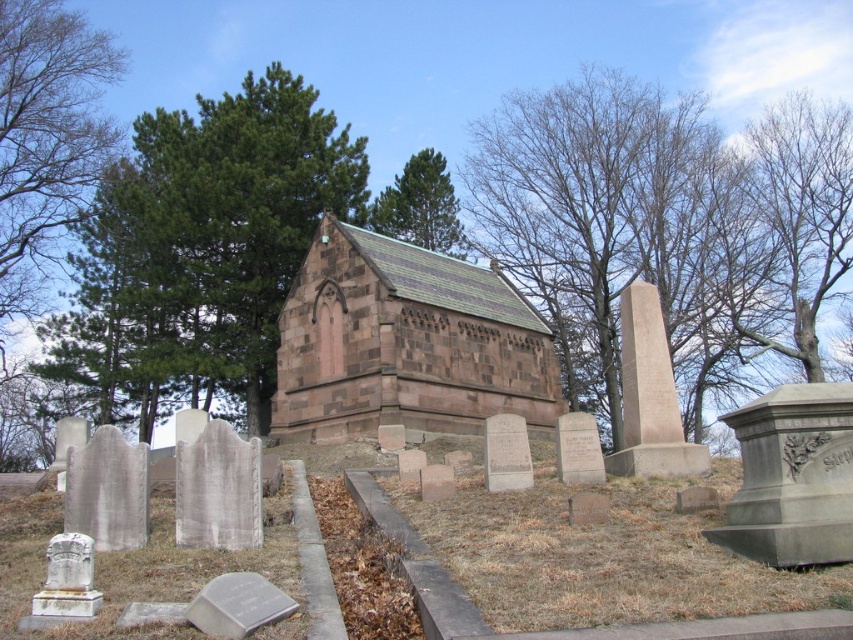
Which is behind, point (366, 260) or point (448, 211)?

Positioned behind is point (448, 211).

Image resolution: width=853 pixels, height=640 pixels. What do you see at coordinates (405, 342) in the screenshot?
I see `brown stone church at center` at bounding box center [405, 342].

I want to click on brown stone church at center, so click(x=405, y=342).

Can you confirm if bare wood tree at upper center is positioned below green leafy tree at upper center?

Yes.

Who is shorter, bare wood tree at upper center or green leafy tree at upper center?

green leafy tree at upper center

Who is more forward, (630,157) or (392,228)?

Point (392,228) is more forward.

Where is `bare wood tree at upper center`? This screenshot has height=640, width=853. bare wood tree at upper center is located at coordinates (608, 225).

Is green leafy tree at upper left wider than green leafy tree at upper center?

Yes, green leafy tree at upper left is wider than green leafy tree at upper center.

Is green leafy tree at upper left positioned in front of green leafy tree at upper center?

Yes.

Where is `green leafy tree at upper left`? The height and width of the screenshot is (640, 853). green leafy tree at upper left is located at coordinates (215, 236).

This screenshot has height=640, width=853. Find the location of `green leafy tree at upper left`. green leafy tree at upper left is located at coordinates (215, 236).